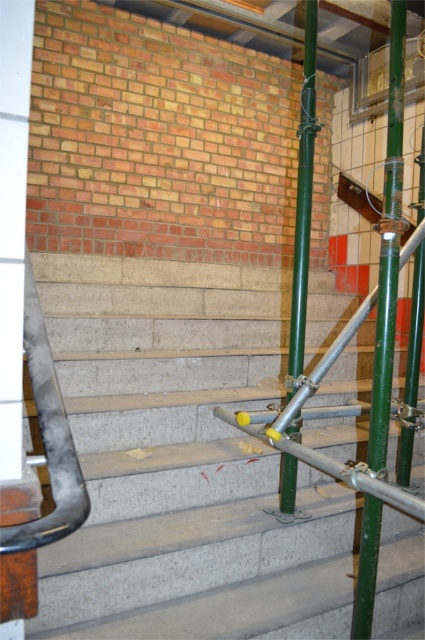
You are a construction worker needing to access the scaffolding. You see the concrete stairs at center and the green metallic pole at center. Which object is positioned to the left of the other?

The concrete stairs at center are to the left of the green metallic pole at center.

You are a construction worker standing on the staircase. You need to reach the green metallic pole at right and the green metallic pole at center to secure them with additional couplers. Which pole should you secure first if you want to start from the lower one?

You should secure the green metallic pole at right first because it is below the green metallic pole at center, so it is lower.

You are a construction worker standing at the bottom of the staircase and looking towards the scaffolding. Which green metallic pole do you see first, the green metallic pole at right or the green metallic pole at center?

The green metallic pole at right is in front of the green metallic pole at center, so you will see the green metallic pole at right first.